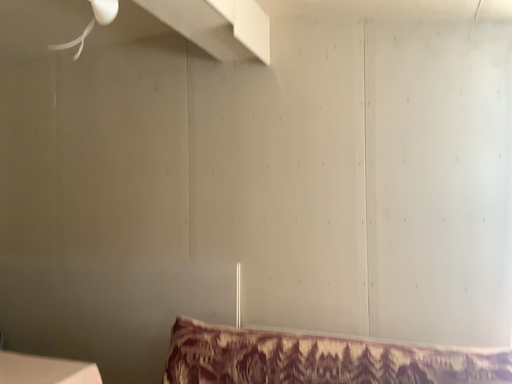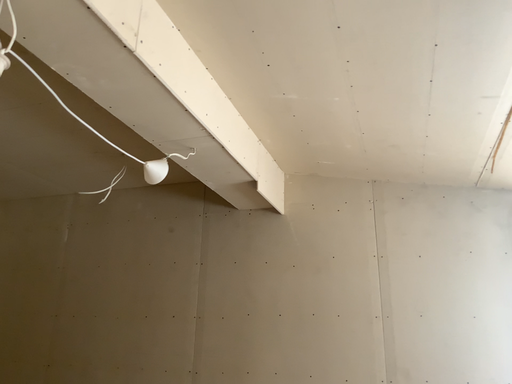
Question: How did the camera likely rotate when shooting the video?

Choices:
 (A) rotated upward
 (B) rotated downward

Answer: (A)